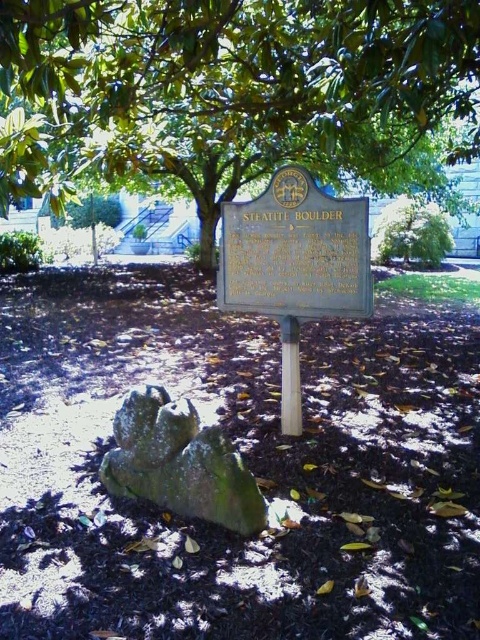
Question: Is green leafy tree at upper center above green mossy rock at center?

Choices:
 (A) yes
 (B) no

Answer: (A)

Question: Is gold plaque at center wider than green mossy rock at center?

Choices:
 (A) no
 (B) yes

Answer: (B)

Question: Which object is farther from the camera taking this photo?

Choices:
 (A) gold plaque at center
 (B) green mossy rock at center

Answer: (A)

Question: Considering the relative positions of green leafy tree at upper center and green mossy rock at center in the image provided, where is green leafy tree at upper center located with respect to green mossy rock at center?

Choices:
 (A) right
 (B) left

Answer: (A)

Question: Which point is closer to the camera?

Choices:
 (A) (269, 218)
 (B) (346, 96)
 (C) (159, 397)

Answer: (B)

Question: Which of the following is the farthest from the observer?

Choices:
 (A) (251, 209)
 (B) (420, 22)

Answer: (A)